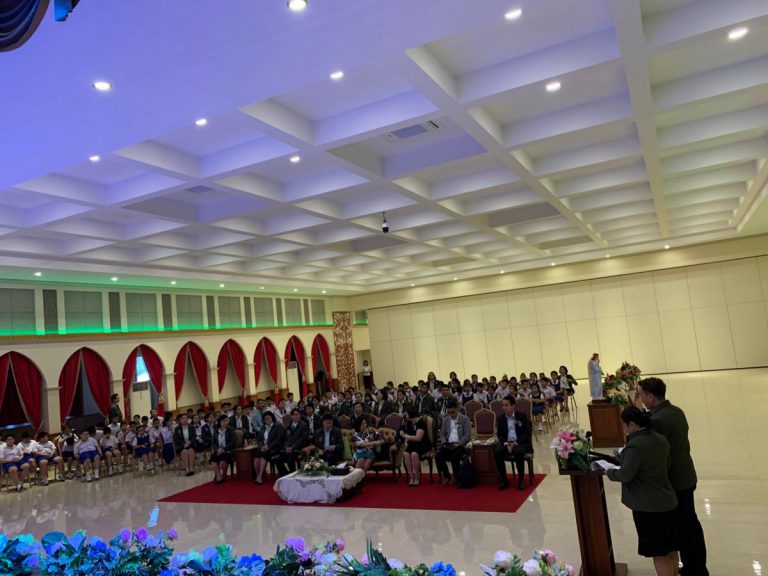
You are a GUI agent. You are given a task and a screenshot of the screen. Output one action in this format:
    pyautogui.click(x=<x>, y=<y>)
    Task: Click on the table
    The image size is (768, 576).
    Given the screenshot: What is the action you would take?
    pyautogui.click(x=316, y=480)